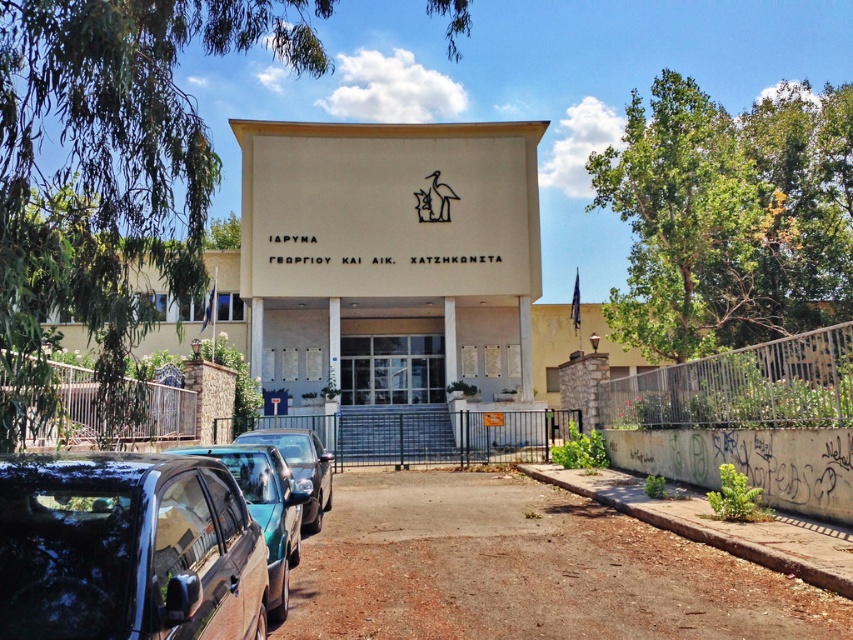
Measure the distance between point (300,515) and camera.

The distance of point (300,515) from camera is 25.21 feet.

Is glossy metallic car at lower left taller than metallic blue car at lower left?

Indeed, glossy metallic car at lower left has a greater height compared to metallic blue car at lower left.

Is point (283, 515) closer to viewer compared to point (294, 468)?

Yes, point (283, 515) is in front of point (294, 468).

This screenshot has width=853, height=640. Identify the location of glossy metallic car at lower left. (265, 508).

Between satin black car at lower left and metallic blue car at lower left, which one appears on the left side from the viewer's perspective?

metallic blue car at lower left

Between satin black car at lower left and metallic blue car at lower left, which one has less height?

metallic blue car at lower left is shorter.

Between point (45, 634) and point (318, 520), which one is positioned behind?

Point (318, 520)

Image resolution: width=853 pixels, height=640 pixels. Find the location of `satin black car at lower left`. satin black car at lower left is located at coordinates (126, 548).

Is satin black car at lower left bigger than glossy metallic car at lower left?

No, satin black car at lower left is not bigger than glossy metallic car at lower left.

Who is positioned more to the left, satin black car at lower left or glossy metallic car at lower left?

Positioned to the left is glossy metallic car at lower left.

Where is `satin black car at lower left`? The height and width of the screenshot is (640, 853). satin black car at lower left is located at coordinates (126, 548).

Identify the location of satin black car at lower left. This screenshot has width=853, height=640. (126, 548).